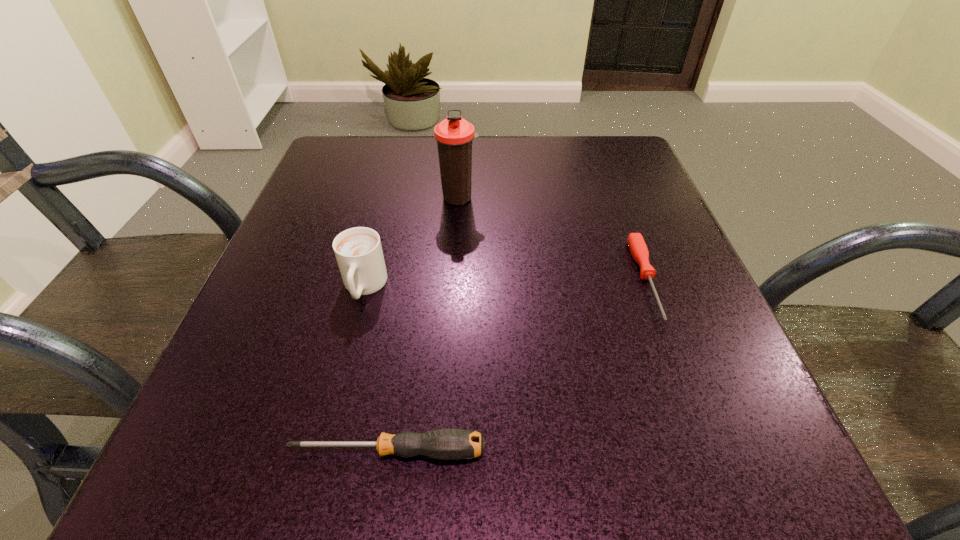
You are a GUI agent. You are given a task and a screenshot of the screen. Output one action in this format:
    pyautogui.click(x=<x>, y=<y>)
    Task: Click on the vacant space located at the tip of the right screwdriver
    The image size is (960, 540).
    Given the screenshot: What is the action you would take?
    pyautogui.click(x=680, y=369)

This screenshot has width=960, height=540. What are the coordinates of `object present at the far edge` in the screenshot? It's located at (454, 135).

Where is `object that is at the near edge`? The width and height of the screenshot is (960, 540). object that is at the near edge is located at coordinates (444, 444).

Find the location of `cappuccino located at the left edge`. cappuccino located at the left edge is located at coordinates (358, 250).

This screenshot has width=960, height=540. In order to click on screwdriver present at the left edge in this screenshot , I will do `click(444, 444)`.

The height and width of the screenshot is (540, 960). In order to click on object present at the right edge in this screenshot , I will do `click(636, 243)`.

Where is `object present at the near left corner`? Image resolution: width=960 pixels, height=540 pixels. object present at the near left corner is located at coordinates tap(444, 444).

Where is `free space at the far edge`? free space at the far edge is located at coordinates (565, 152).

In the image, there is a desktop. Where is `free space at the near edge`? The width and height of the screenshot is (960, 540). free space at the near edge is located at coordinates (627, 494).

Find the location of `free space at the left edge of the desktop`. free space at the left edge of the desktop is located at coordinates (296, 269).